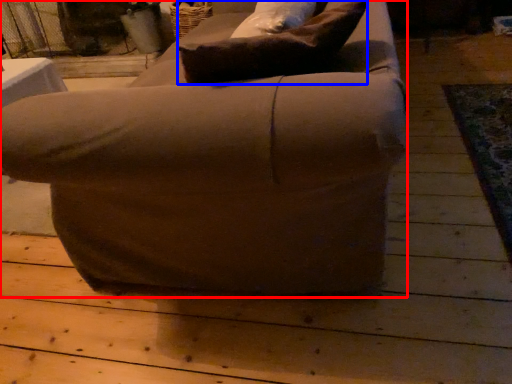
Question: Among these objects, which one is nearest to the camera, chair (highlighted by a red box) or pillow (highlighted by a blue box)?

Choices:
 (A) chair
 (B) pillow

Answer: (A)